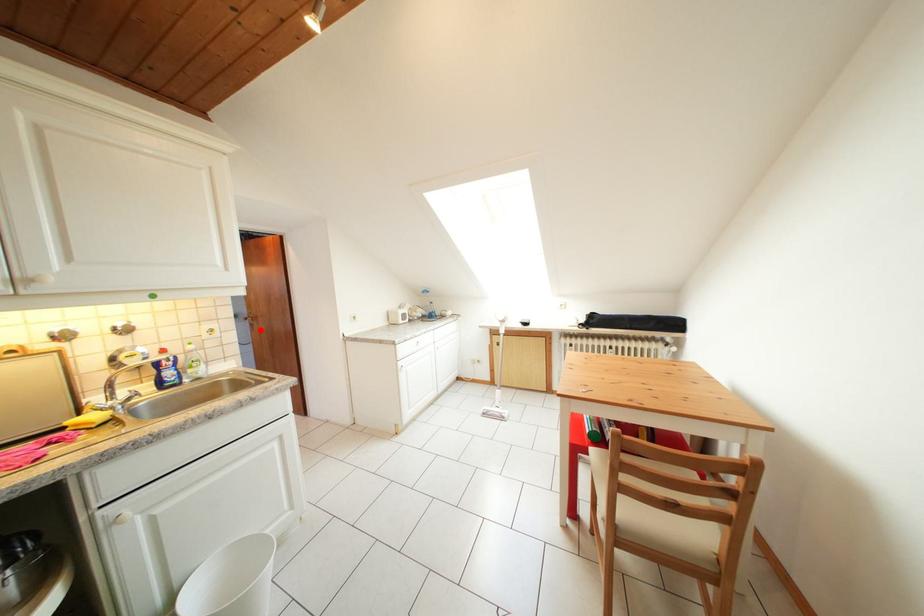
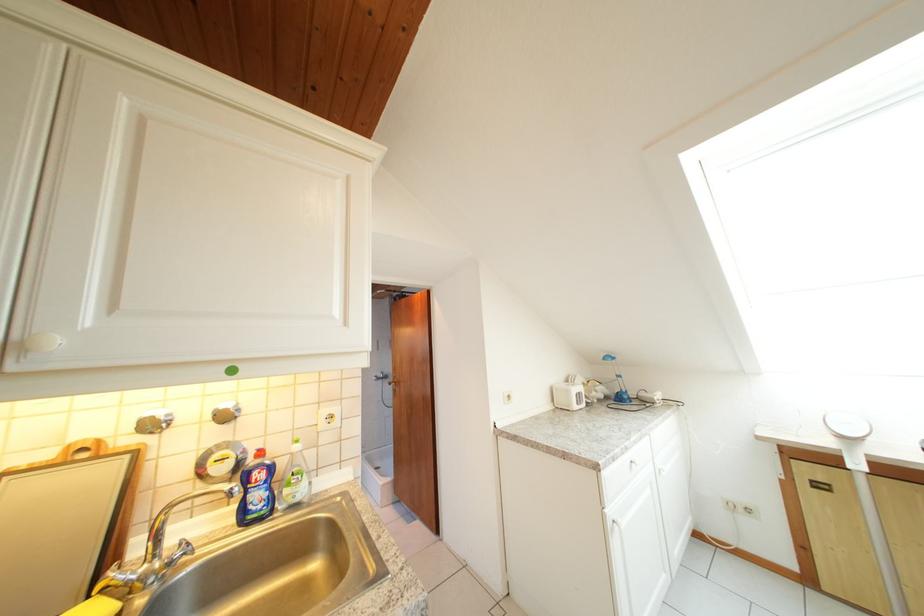
Question: I am providing you with two images of the same scene from different viewpoints. Image1 has a red point marked. In image2, the corresponding 3D location appears at what relative position? Reply with the corresponding letter.

Choices:
 (A) Closer
 (B) Farther

Answer: (B)